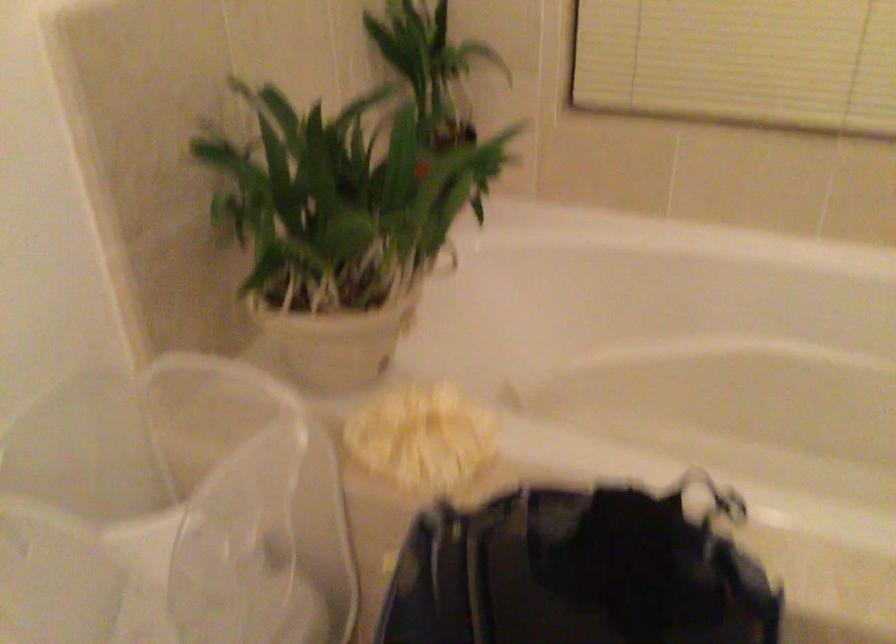
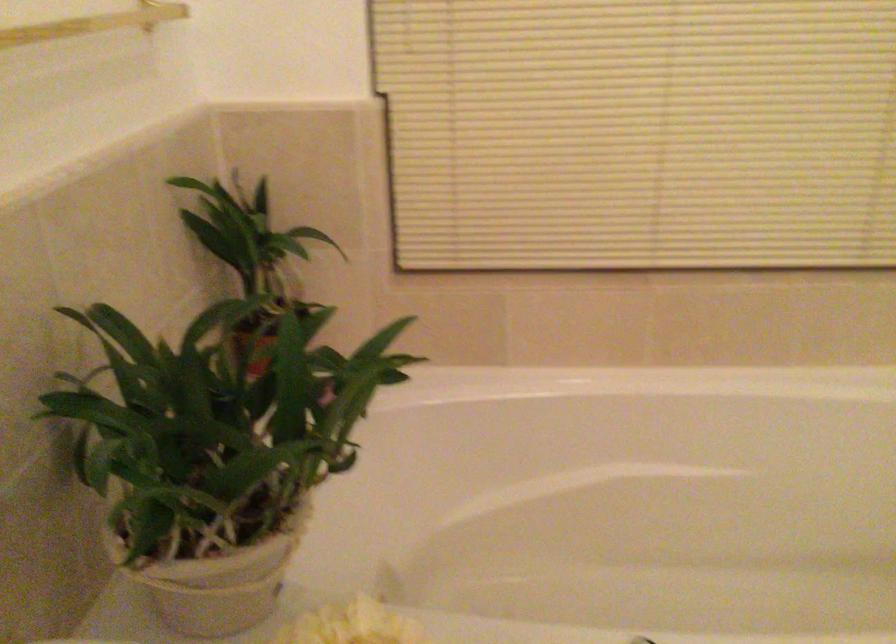
Which direction would the cameraman need to move to produce the second image?

The cameraman moved toward left, forward.